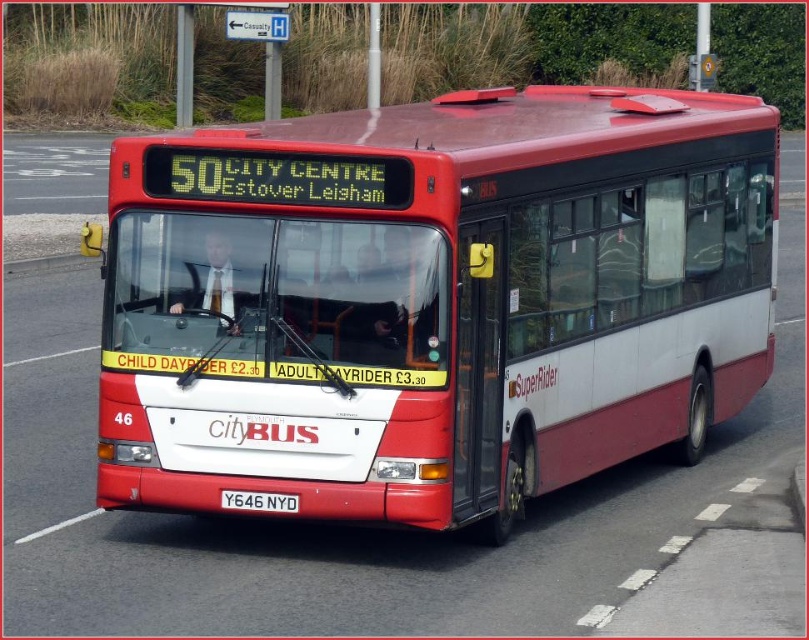
You are a pedestrian standing at the metal signpost at upper center and want to cross the road to reach the matte red bus at center. If the traffic light turns green, can you safely walk to the bus within 15 seconds? Assume your walking speed is 1.5 meters per second.

The distance between the matte red bus at center and the metal signpost at upper center is 25.90 meters. At a walking speed of 1.5 meters per second, it would take approximately 17.27 seconds to cover the distance. Since 17.27 seconds is longer than 15 seconds, you cannot safely reach the bus within the given time frame.

What are the coordinates of the matte red bus at center?

The coordinates of the matte red bus at center are at point (433, 300).